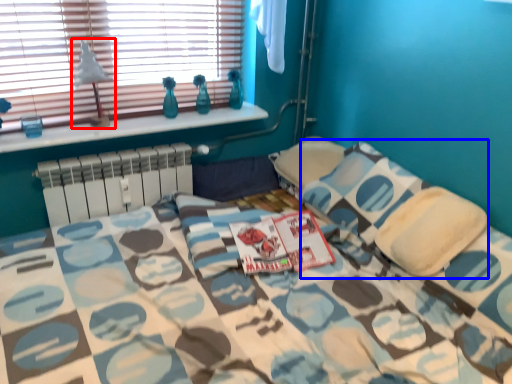
Question: Which object is closer to the camera taking this photo, table lamp (highlighted by a red box) or pillow (highlighted by a blue box)?

Choices:
 (A) table lamp
 (B) pillow

Answer: (B)